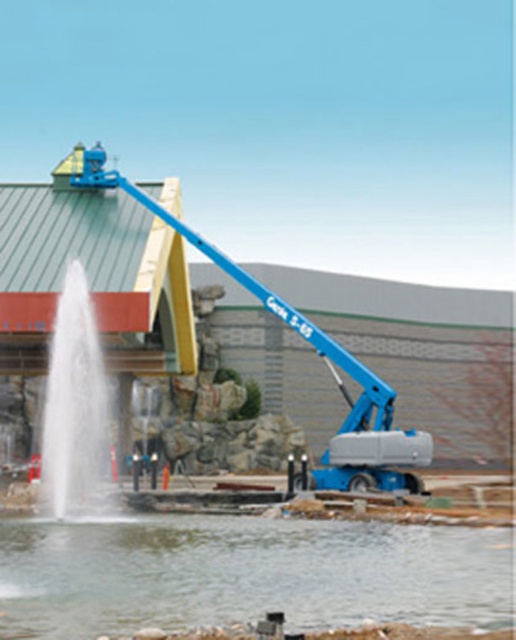
Can you confirm if white frothy water at center is positioned above blue metallic lift at center?

No, white frothy water at center is not above blue metallic lift at center.

Can you confirm if white frothy water at center is wider than blue metallic lift at center?

Incorrect, white frothy water at center's width does not surpass blue metallic lift at center's.

Who is more distant from viewer, (x=83, y=310) or (x=216, y=260)?

Point (x=216, y=260)

The image size is (516, 640). I want to click on white frothy water at center, so click(x=76, y=412).

Does clear water at lower center have a greater height compared to blue metallic lift at center?

Incorrect, clear water at lower center's height is not larger of blue metallic lift at center's.

Is clear water at lower center shorter than blue metallic lift at center?

Indeed, clear water at lower center has a lesser height compared to blue metallic lift at center.

Is point (462, 605) closer to viewer compared to point (328, 456)?

Yes, it is.

You are a GUI agent. You are given a task and a screenshot of the screen. Output one action in this format:
    pyautogui.click(x=<x>, y=<y>)
    Task: Click on the clear water at lower center
    This screenshot has width=516, height=640.
    Given the screenshot: What is the action you would take?
    pyautogui.click(x=245, y=573)

Can you confirm if clear water at lower center is thinner than white frothy water at center?

No, clear water at lower center is not thinner than white frothy water at center.

Does point (68, 522) come in front of point (45, 502)?

Yes, point (68, 522) is closer to viewer.

Identify the location of clear water at lower center. (245, 573).